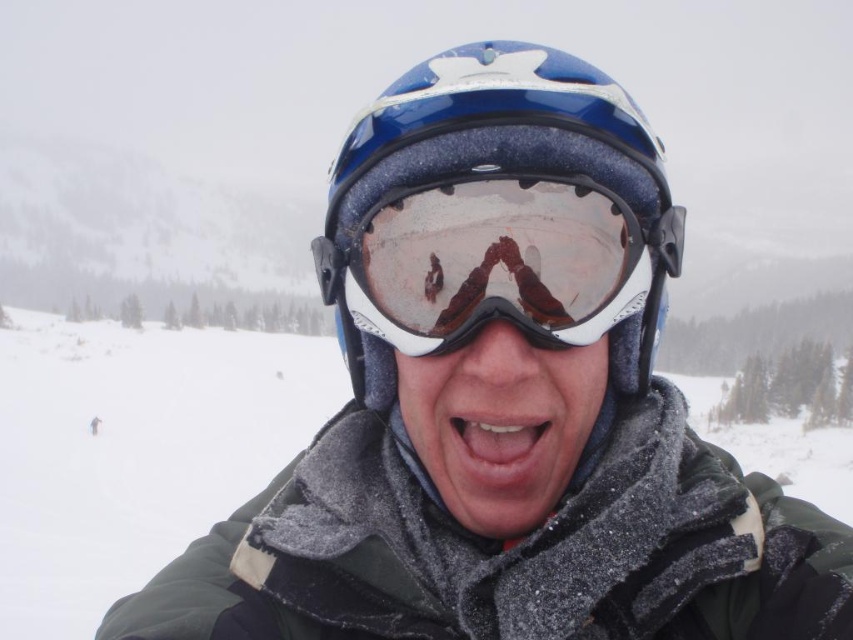
Question: Estimate the real-world distances between objects in this image. Which object is farther from the transparent plastic goggles at center?

Choices:
 (A) satin white goggles at center
 (B) smooth skin mouth at center
 (C) blue matte helmet at center

Answer: (B)

Question: Does transparent plastic goggles at center have a lesser width compared to smooth skin mouth at center?

Choices:
 (A) no
 (B) yes

Answer: (A)

Question: Among these points, which one is farthest from the camera?

Choices:
 (A) (491, 461)
 (B) (405, 275)
 (C) (503, 298)
 (D) (482, 452)

Answer: (D)

Question: Estimate the real-world distances between objects in this image. Which object is closer to the smooth skin mouth at center?

Choices:
 (A) transparent plastic goggles at center
 (B) blue matte helmet at center
 (C) satin white goggles at center

Answer: (C)

Question: Is transparent plastic goggles at center closer to camera compared to satin white goggles at center?

Choices:
 (A) no
 (B) yes

Answer: (B)

Question: Can you confirm if satin white goggles at center is positioned below smooth skin mouth at center?

Choices:
 (A) no
 (B) yes

Answer: (A)